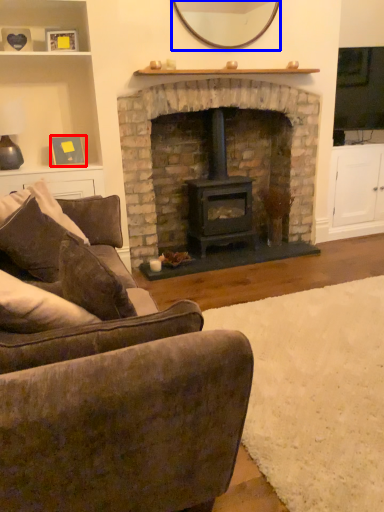
Question: Which of the following is the farthest to the observer, picture frame (highlighted by a red box) or mirror (highlighted by a blue box)?

Choices:
 (A) picture frame
 (B) mirror

Answer: (A)